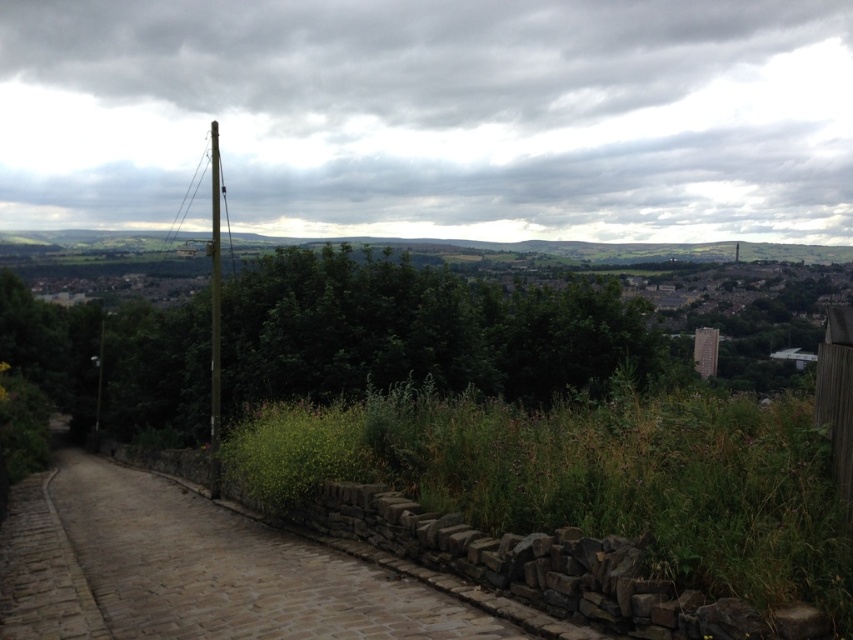
Question: Does green leafy tree at center appear on the left side of brown cobblestone path at lower left?

Choices:
 (A) no
 (B) yes

Answer: (B)

Question: Is green leafy tree at center bigger than brown cobblestone path at lower left?

Choices:
 (A) yes
 (B) no

Answer: (A)

Question: Which point appears closest to the camera in this image?

Choices:
 (A) (144, 637)
 (B) (460, 369)

Answer: (A)

Question: Is green leafy tree at center closer to camera compared to brown cobblestone path at lower left?

Choices:
 (A) no
 (B) yes

Answer: (A)